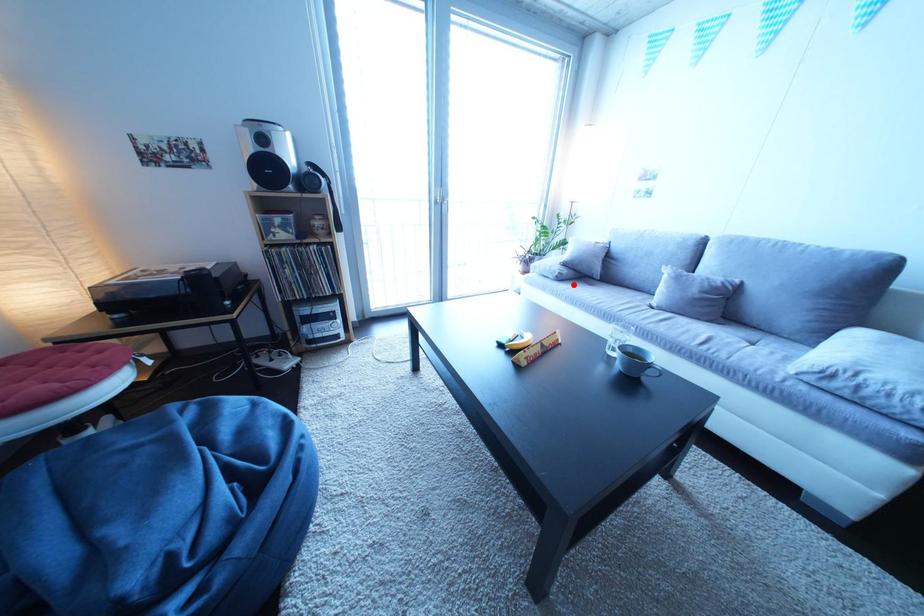
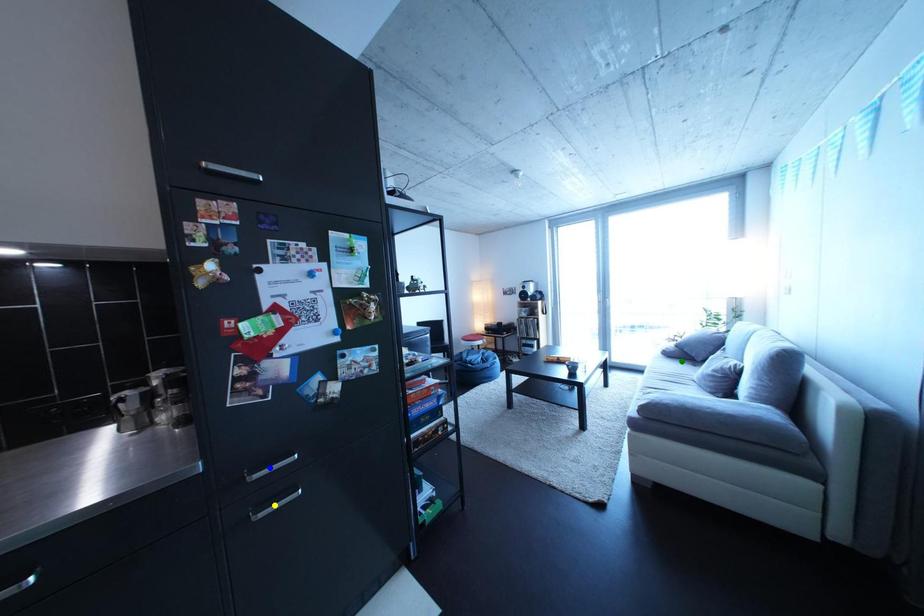
Question: I am providing you with two images of the same scene from different viewpoints. A red point is marked on the first image. You are given multiple points on the second image. Which mark in image 2 goes with the point in image 1?

Choices:
 (A) green point
 (B) blue point
 (C) yellow point

Answer: (A)